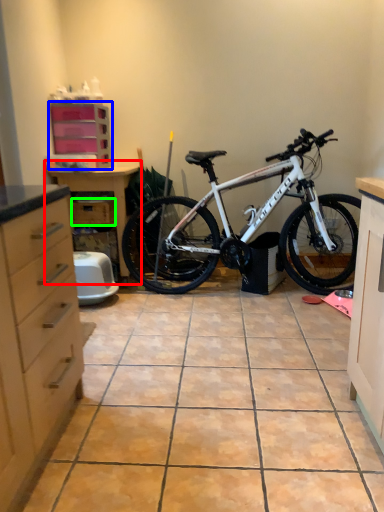
Question: Which object is positioned closest to dresser (highlighted by a red box)? Select from cabinetry (highlighted by a blue box) and drawer (highlighted by a green box).

Choices:
 (A) cabinetry
 (B) drawer

Answer: (B)